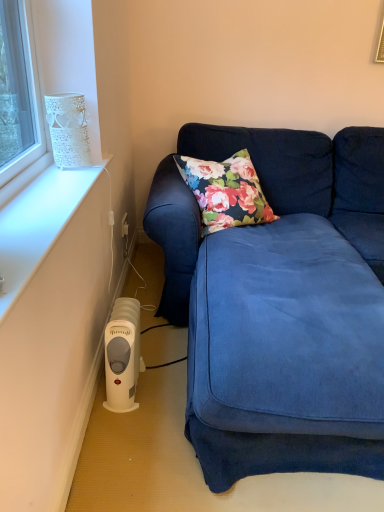
Question: From a real-world perspective, does velvet blue couch at lower right stand above white plastic heater at lower left?

Choices:
 (A) yes
 (B) no

Answer: (A)

Question: From the image's perspective, is velvet blue couch at lower right beneath white plastic heater at lower left?

Choices:
 (A) yes
 (B) no

Answer: (B)

Question: Can you confirm if velvet blue couch at lower right is shorter than white plastic heater at lower left?

Choices:
 (A) yes
 (B) no

Answer: (B)

Question: Is velvet blue couch at lower right in contact with white plastic heater at lower left?

Choices:
 (A) yes
 (B) no

Answer: (B)

Question: From the image's perspective, is velvet blue couch at lower right over white plastic heater at lower left?

Choices:
 (A) no
 (B) yes

Answer: (B)

Question: Does point (226, 409) appear closer or farther from the camera than point (120, 366)?

Choices:
 (A) closer
 (B) farther

Answer: (A)

Question: From a real-world perspective, is velvet blue couch at lower right positioned above or below white plastic heater at lower left?

Choices:
 (A) above
 (B) below

Answer: (A)

Question: From the image's perspective, is velvet blue couch at lower right positioned above or below white plastic heater at lower left?

Choices:
 (A) below
 (B) above

Answer: (B)

Question: Considering the positions of velvet blue couch at lower right and white plastic heater at lower left in the image, is velvet blue couch at lower right wider or thinner than white plastic heater at lower left?

Choices:
 (A) wide
 (B) thin

Answer: (A)

Question: Considering the positions of point (79, 99) and point (132, 350), is point (79, 99) closer or farther from the camera than point (132, 350)?

Choices:
 (A) closer
 (B) farther

Answer: (B)

Question: From a real-world perspective, is white textured vase at upper left positioned above or below white plastic heater at lower left?

Choices:
 (A) below
 (B) above

Answer: (B)

Question: Based on their positions, is white textured vase at upper left located to the left or right of white plastic heater at lower left?

Choices:
 (A) left
 (B) right

Answer: (A)

Question: In terms of size, does white textured vase at upper left appear bigger or smaller than white plastic heater at lower left?

Choices:
 (A) big
 (B) small

Answer: (B)

Question: From a real-world perspective, is white plastic heater at lower left physically located above or below velvet blue couch at lower right?

Choices:
 (A) below
 (B) above

Answer: (A)

Question: Would you say white plastic heater at lower left is inside or outside velvet blue couch at lower right?

Choices:
 (A) inside
 (B) outside

Answer: (A)